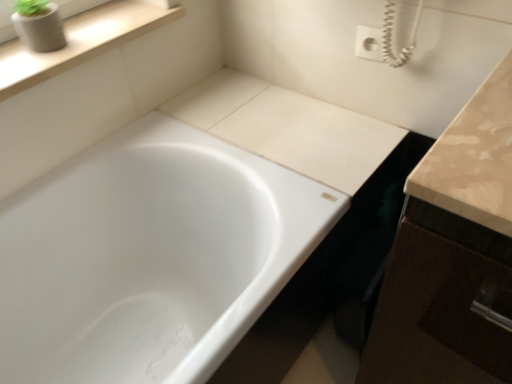
Identify the location of vacant point above wooden at upper left (from a real-world perspective). The height and width of the screenshot is (384, 512). (79, 31).